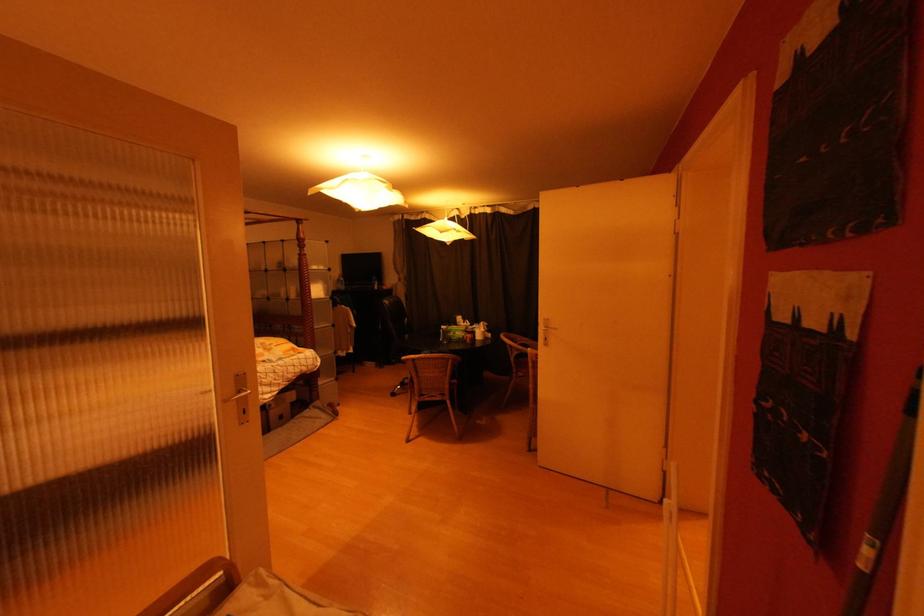
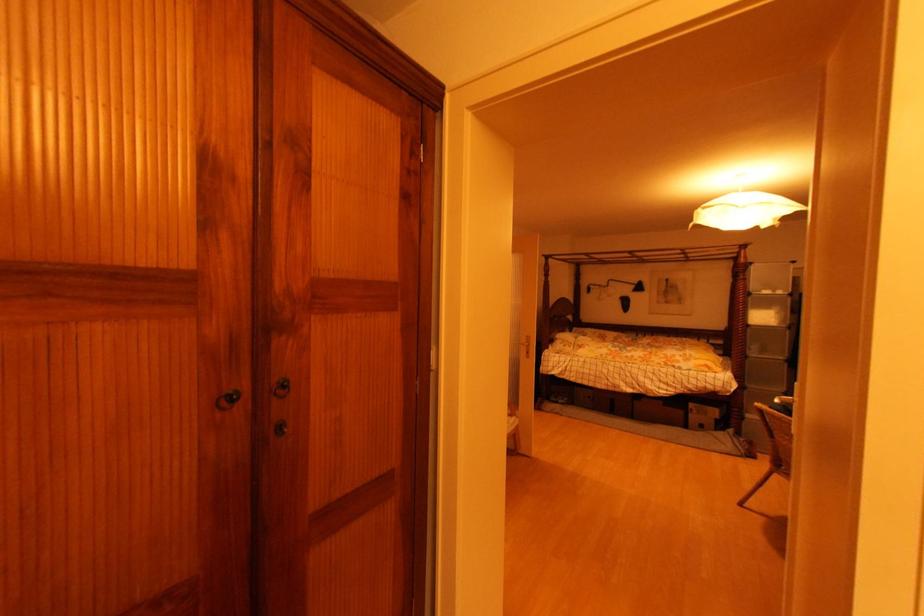
Locate, in the second image, the point that corresponds to (325,270) in the first image.

(784, 294)